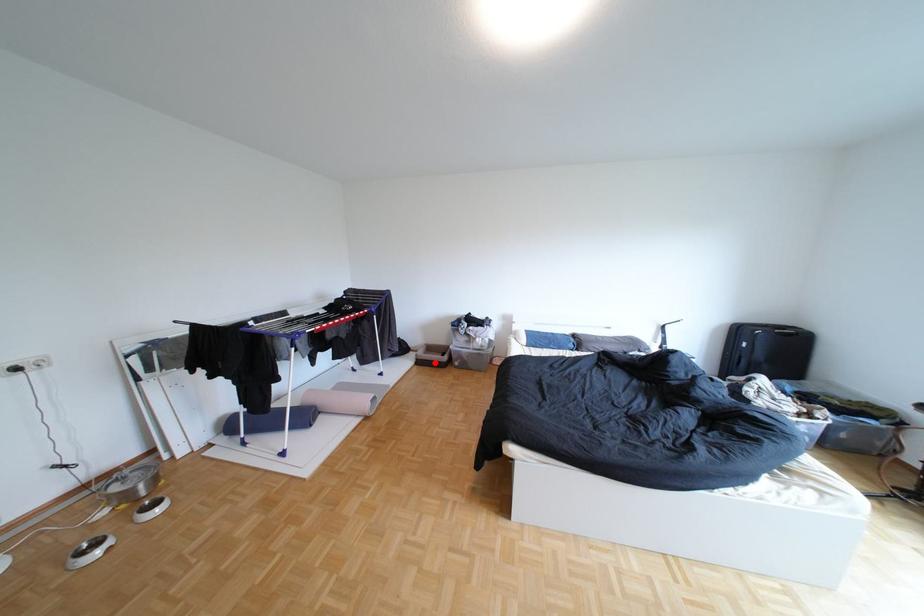
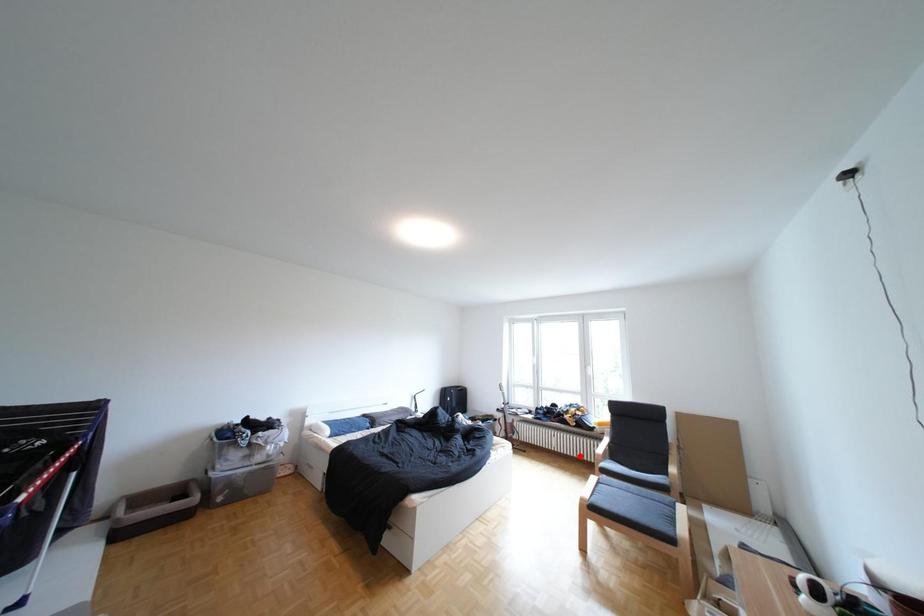
I am providing you with two images of the same scene from different viewpoints. A red point is marked on the first image and another point is marked on the second image. Is the red point in image1 aligned with the point shown in image2?

No